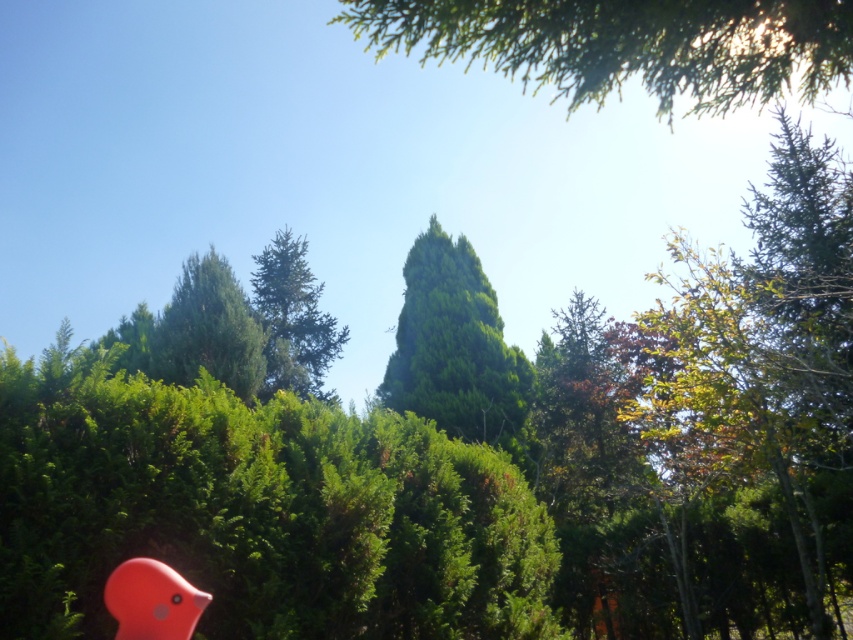
What do you see at coordinates (207, 330) in the screenshot?
I see `green textured tree at upper left` at bounding box center [207, 330].

Between point (177, 294) and point (138, 609), which one is positioned in front?

Point (138, 609) is in front.

At what (x,y) coordinates should I click in order to perform the action: click on green textured tree at upper left. Please return your answer as a coordinate pair (x, y). Looking at the image, I should click on (207, 330).

Between green needle-like tree at center and rubber duck at lower left, which one appears on the right side from the viewer's perspective?

From the viewer's perspective, rubber duck at lower left appears more on the right side.

Does point (299, 248) lie in front of point (146, 586)?

No, it is not.

Find the location of a particular element. The image size is (853, 640). green needle-like tree at center is located at coordinates (292, 317).

Where is `green needle-like tree at center`? The image size is (853, 640). green needle-like tree at center is located at coordinates (292, 317).

Which is behind, point (509, 372) or point (120, 595)?

The point (509, 372) is behind.

Between green leafy tree at center and rubber duck at lower left, which one appears on the right side from the viewer's perspective?

From the viewer's perspective, green leafy tree at center appears more on the right side.

Which is in front, point (432, 417) or point (161, 570)?

Point (161, 570)

Locate an element on the screen. The height and width of the screenshot is (640, 853). green leafy tree at center is located at coordinates (456, 346).